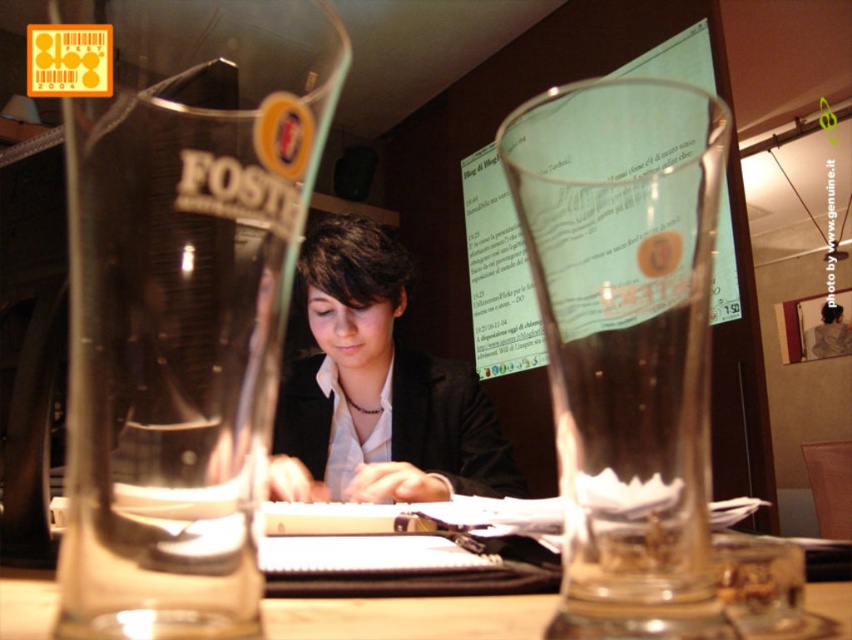
You are a customer at the cafe and want to grab your drink without moving your jacket. Based on the scene, which object is closer to you, the transparent glass foster beer glass at left or the matte black jacket at center?

The transparent glass foster beer glass at left is closer to you because it is in front of the matte black jacket at center.

You are a bartender preparing drinks for a customer. You have two glasses in front of you, the transparent glass foster beer glass at left and the transparent glass at center. Which glass should you choose if you need to serve a standard 12 oz beer?

The transparent glass foster beer glass at left has a larger size compared to the transparent glass at center, so it is more suitable for serving a standard 12 oz beer.

You are a customer at the cafe and want to order a drink. You see a point marked at coordinates (626, 340). What object is located at that point?

The point at coordinates (626, 340) marks the transparent glass at center.